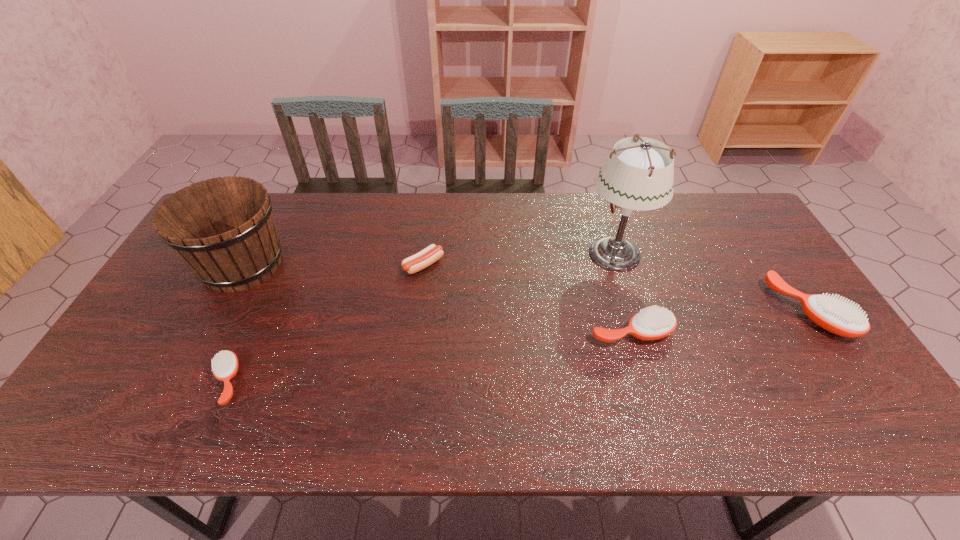
To achieve uniform spacing by inserting another hairbrush among them, please point to a free space for this new hairbrush. Please provide its 2D coordinates. Your answer should be formatted as a tuple, i.e. [(x, y)], where the tuple contains the x and y coordinates of a point satisfying the conditions above.

[(438, 355)]